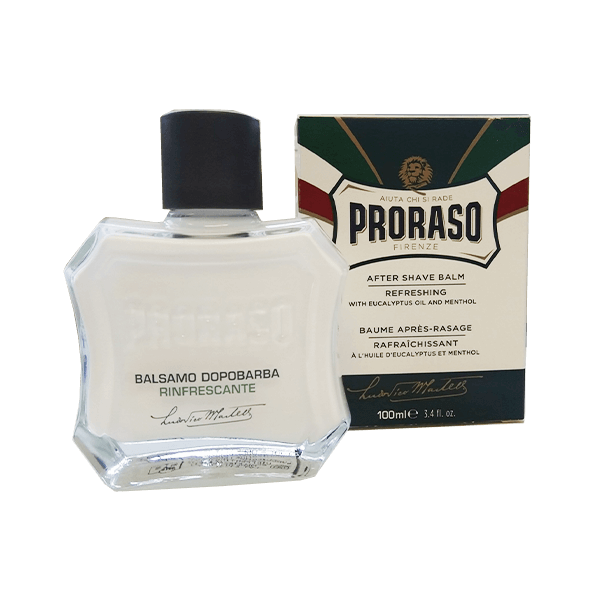
The height and width of the screenshot is (600, 600). In order to click on bottle in this screenshot , I will do `click(297, 300)`.